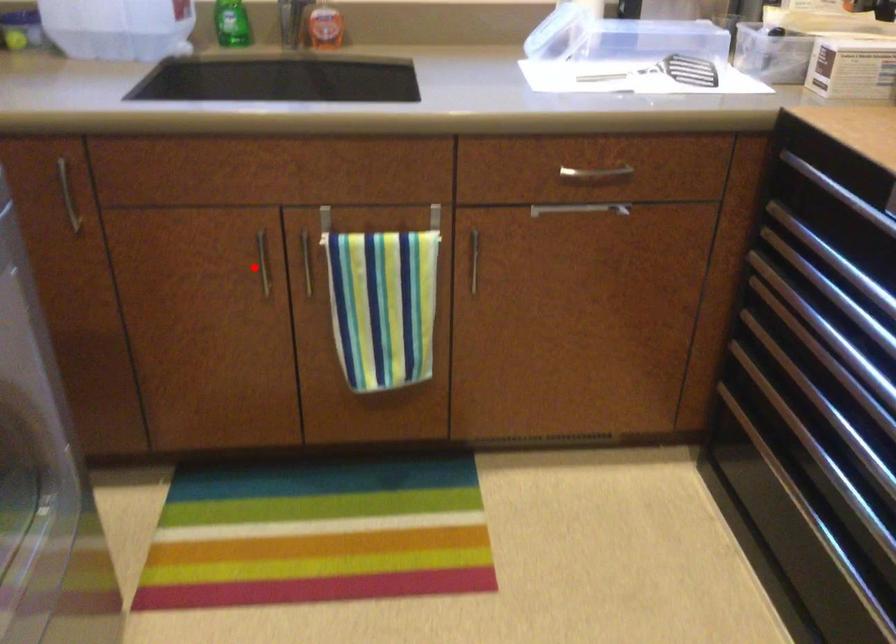
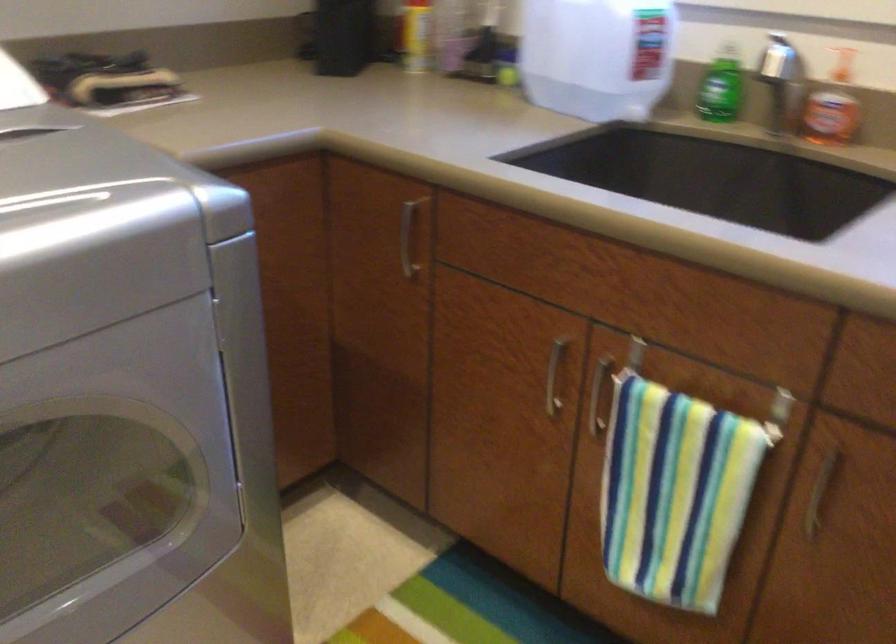
Where in the second image is the point corresponding to the highlighted location from the first image?

(554, 375)